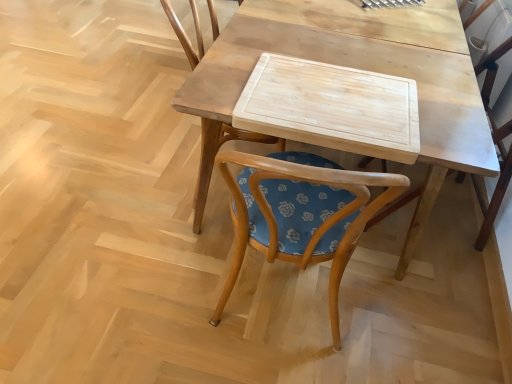
This screenshot has height=384, width=512. What are the coordinates of `vacant area to the left of wooden cutting board at center` in the screenshot? It's located at (102, 125).